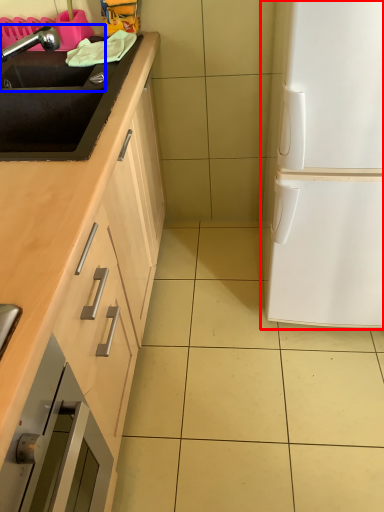
Question: Which object appears farthest to the camera in this image, fridge (highlighted by a red box) or sink (highlighted by a blue box)?

Choices:
 (A) fridge
 (B) sink

Answer: (B)